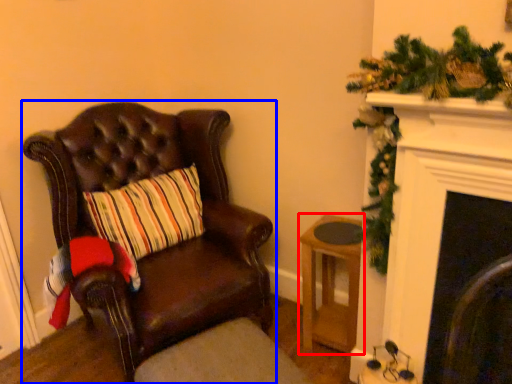
Question: Which of the following is the closest to the observer, stool (highlighted by a red box) or chair (highlighted by a blue box)?

Choices:
 (A) stool
 (B) chair

Answer: (B)